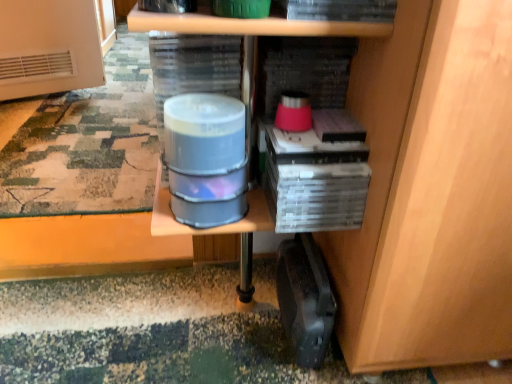
Locate an element on the screen. vacant space to the left of black plastic briefcase at lower right is located at coordinates (223, 327).